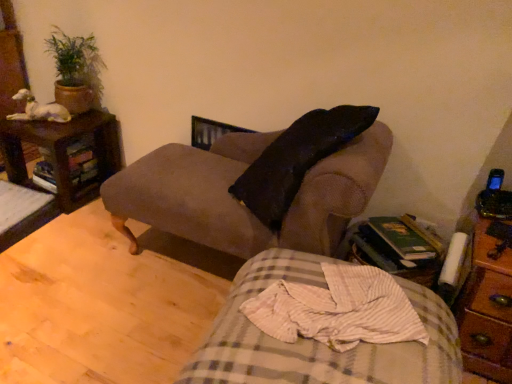
At what (x,y) coordinates should I click in order to perform the action: click on free location to the left of plaid fabric bed at lower center. Please return your answer as a coordinate pair (x, y). This screenshot has height=384, width=512. Looking at the image, I should click on (124, 332).